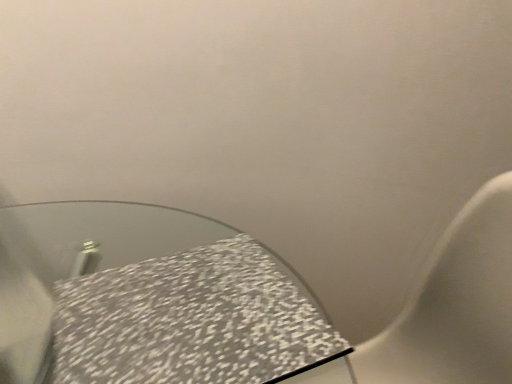
The image size is (512, 384). What are the coordinates of `speckled ceramic toilet at lower left` in the screenshot? It's located at (454, 305).

The height and width of the screenshot is (384, 512). What do you see at coordinates (454, 305) in the screenshot?
I see `speckled ceramic toilet at lower left` at bounding box center [454, 305].

You are a GUI agent. You are given a task and a screenshot of the screen. Output one action in this format:
    pyautogui.click(x=<x>, y=<y>)
    Task: Click on the speckled fabric tablecloth at lower left
    Image resolution: width=512 pixels, height=384 pixels.
    Given the screenshot: What is the action you would take?
    pyautogui.click(x=191, y=321)

What do you see at coordinates (191, 321) in the screenshot? Image resolution: width=512 pixels, height=384 pixels. I see `speckled fabric tablecloth at lower left` at bounding box center [191, 321].

At what (x,y) coordinates should I click in order to perform the action: click on speckled ceramic toilet at lower left. Please return your answer as a coordinate pair (x, y). The image size is (512, 384). Looking at the image, I should click on (454, 305).

Which object is positioned more to the left, speckled ceramic toilet at lower left or speckled fabric tablecloth at lower left?

Positioned to the left is speckled fabric tablecloth at lower left.

Which object is further away from the camera, speckled ceramic toilet at lower left or speckled fabric tablecloth at lower left?

Positioned behind is speckled fabric tablecloth at lower left.

Which is nearer, (42, 316) or (127, 376)?

Clearly, point (42, 316) is more distant from the camera than point (127, 376).

From the image's perspective, is speckled ceramic toilet at lower left above speckled fabric tablecloth at lower left?

No, from the image's perspective, speckled ceramic toilet at lower left is not above speckled fabric tablecloth at lower left.

From a real-world perspective, is speckled ceramic toilet at lower left below speckled fabric tablecloth at lower left?

Yes, from a real-world perspective, speckled ceramic toilet at lower left is beneath speckled fabric tablecloth at lower left.

Which of these two, speckled ceramic toilet at lower left or speckled fabric tablecloth at lower left, is wider?

With larger width is speckled ceramic toilet at lower left.

Who is taller, speckled ceramic toilet at lower left or speckled fabric tablecloth at lower left?

Standing taller between the two is speckled ceramic toilet at lower left.

Who is smaller, speckled ceramic toilet at lower left or speckled fabric tablecloth at lower left?

With smaller size is speckled fabric tablecloth at lower left.

Is speckled ceramic toilet at lower left inside the boundaries of speckled fabric tablecloth at lower left, or outside?

speckled ceramic toilet at lower left is outside speckled fabric tablecloth at lower left.

Would you consider speckled ceramic toilet at lower left to be distant from speckled fabric tablecloth at lower left?

No.

Is speckled ceramic toilet at lower left positioned with its back to speckled fabric tablecloth at lower left?

No.

Could you measure the distance between speckled ceramic toilet at lower left and speckled fabric tablecloth at lower left?

A distance of 18.64 inches exists between speckled ceramic toilet at lower left and speckled fabric tablecloth at lower left.

Image resolution: width=512 pixels, height=384 pixels. I want to click on tablecloth on the left of the speckled ceramic toilet at lower left, so click(191, 321).

Does speckled fabric tablecloth at lower left appear on the right side of speckled ceramic toilet at lower left?

No.

Which object is further away from the camera taking this photo, speckled fabric tablecloth at lower left or speckled ceramic toilet at lower left?

speckled fabric tablecloth at lower left is behind.

Does point (244, 259) come behind point (463, 359)?

No, (244, 259) is in front of (463, 359).

From the image's perspective, between speckled fabric tablecloth at lower left and speckled ceramic toilet at lower left, which one is located above?

speckled fabric tablecloth at lower left, from the image's perspective.

In the scene shown: From a real-world perspective, who is located higher, speckled fabric tablecloth at lower left or speckled ceramic toilet at lower left?

From a 3D spatial view, speckled fabric tablecloth at lower left is above.

Which of these two, speckled fabric tablecloth at lower left or speckled ceramic toilet at lower left, is wider?

speckled ceramic toilet at lower left.

Is speckled fabric tablecloth at lower left shorter than speckled ceramic toilet at lower left?

Yes.

Which of these two, speckled fabric tablecloth at lower left or speckled ceramic toilet at lower left, is smaller?

speckled fabric tablecloth at lower left is smaller.

Is speckled fabric tablecloth at lower left completely or partially outside of speckled ceramic toilet at lower left?

No.

Is speckled fabric tablecloth at lower left not close to speckled ceramic toilet at lower left?

No.

Is speckled fabric tablecloth at lower left aimed at speckled ceramic toilet at lower left?

Yes, speckled fabric tablecloth at lower left is aimed at speckled ceramic toilet at lower left.

How far apart are speckled fabric tablecloth at lower left and speckled ceramic toilet at lower left?

The distance of speckled fabric tablecloth at lower left from speckled ceramic toilet at lower left is 18.64 inches.

Find the location of a particular element. toilet below the speckled fabric tablecloth at lower left (from the image's perspective) is located at coordinates (454, 305).

Image resolution: width=512 pixels, height=384 pixels. Find the location of `toilet located in front of the speckled fabric tablecloth at lower left`. toilet located in front of the speckled fabric tablecloth at lower left is located at coordinates pyautogui.click(x=454, y=305).

I want to click on tablecloth that appears above the speckled ceramic toilet at lower left (from a real-world perspective), so (x=191, y=321).